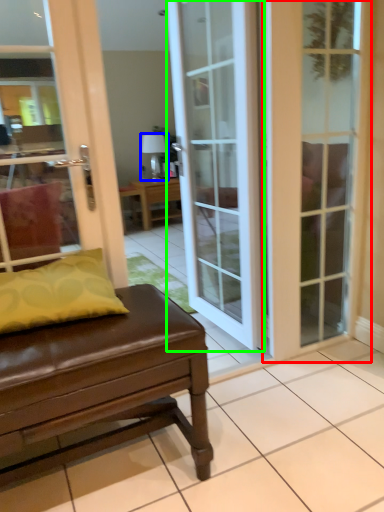
Question: Which object is the closest to the door (highlighted by a red box)? Choose among these: lamp (highlighted by a blue box) or door (highlighted by a green box).

Choices:
 (A) lamp
 (B) door

Answer: (B)